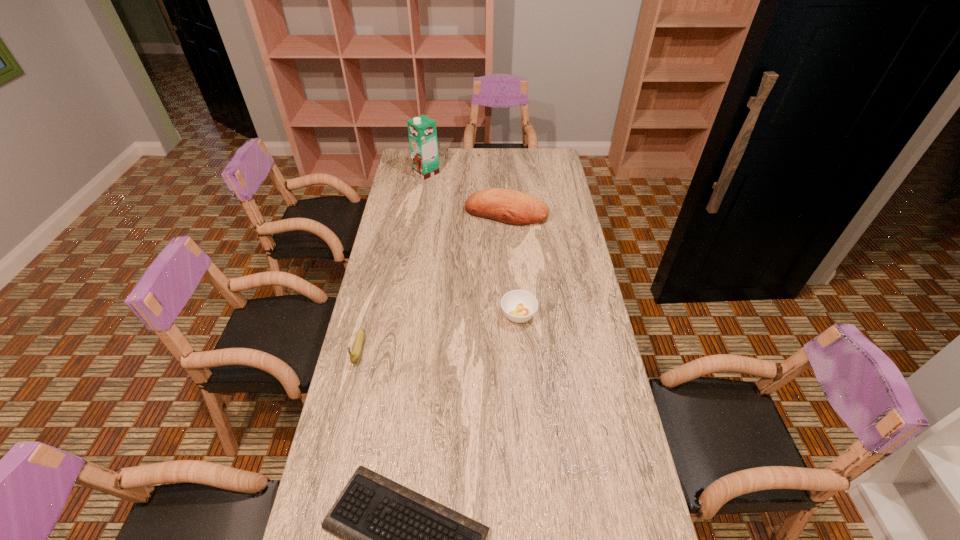
At what (x,y) coordinates should I click in order to perform the action: click on the tallest object. Please return your answer as a coordinate pair (x, y). Looking at the image, I should click on (422, 132).

What are the coordinates of `the farthest object` in the screenshot? It's located at (422, 132).

You are a GUI agent. You are given a task and a screenshot of the screen. Output one action in this format:
    pyautogui.click(x=<x>, y=<y>)
    Task: Click on the bread
    The image size is (960, 540).
    Given the screenshot: What is the action you would take?
    pyautogui.click(x=512, y=207)

Locate an element on the screen. the leftmost object is located at coordinates (354, 357).

Where is `banana`? banana is located at coordinates (354, 357).

Find the location of `soup bowl`. soup bowl is located at coordinates (519, 306).

The width and height of the screenshot is (960, 540). Identify the location of the fourth nearest object. (519, 306).

Identify the location of spectacles. (x=573, y=469).

You are a GUI agent. You are given a task and a screenshot of the screen. Output one action in this format:
    pyautogui.click(x=<x>, y=<y>)
    Task: Click on the free location located 0.110m on the front of the tallest object
    
    Given the screenshot: What is the action you would take?
    pyautogui.click(x=423, y=193)

Locate an element on the screen. This screenshot has width=960, height=540. free spot located 0.140m on the front of the fifth nearest object is located at coordinates point(509,249).